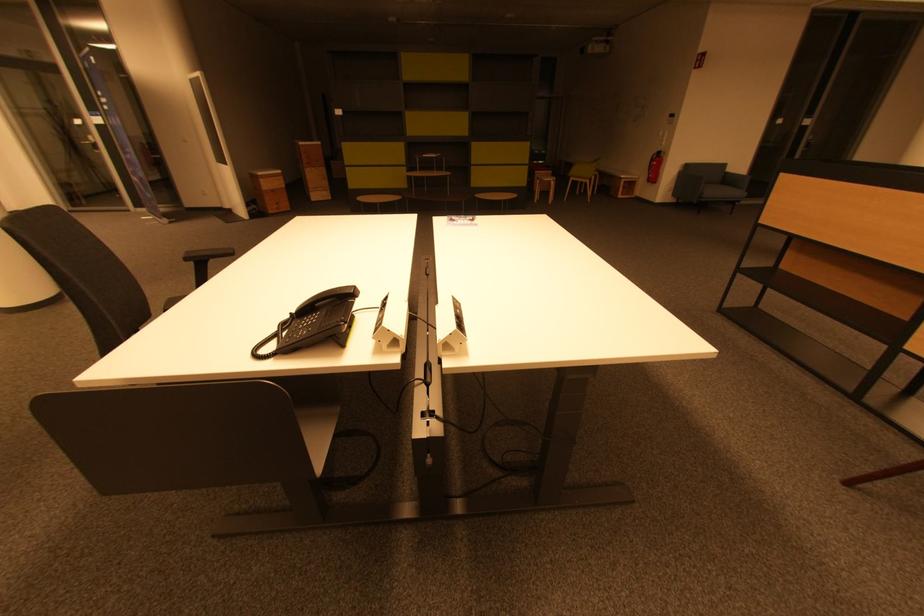
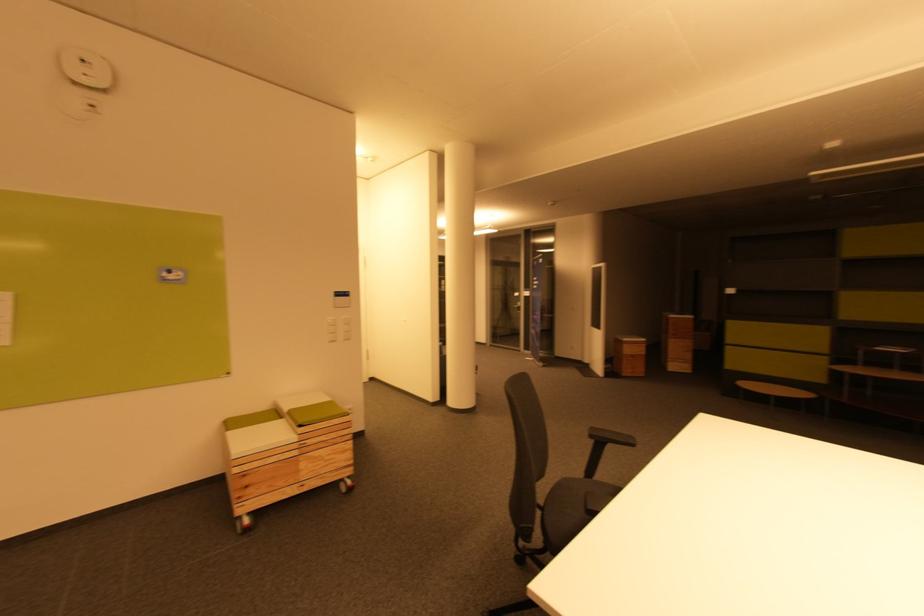
Where in the second image is the point corresponding to the point at 367,201 from the first image?

(748, 387)